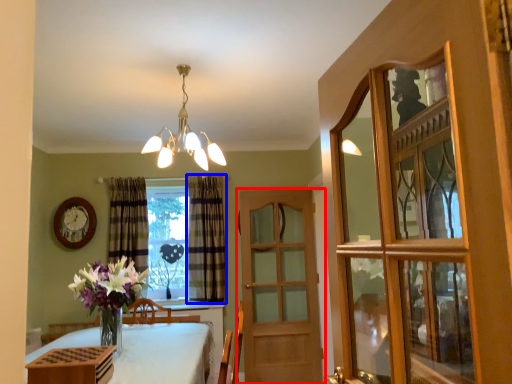
Question: Which object is further to the camera taking this photo, door (highlighted by a red box) or curtain (highlighted by a blue box)?

Choices:
 (A) door
 (B) curtain

Answer: (B)